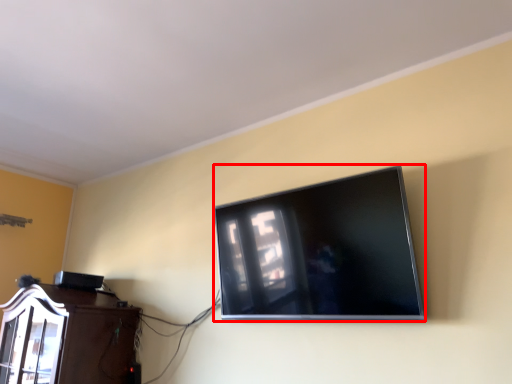
Question: From the image, what is the correct spatial relationship of television (annotated by the red box) in relation to furniture?

Choices:
 (A) left
 (B) right

Answer: (B)